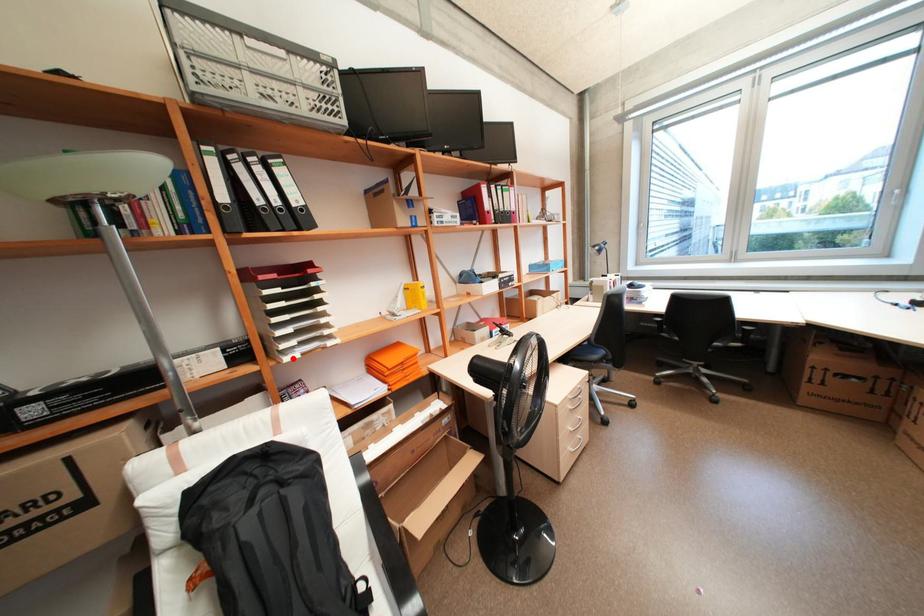
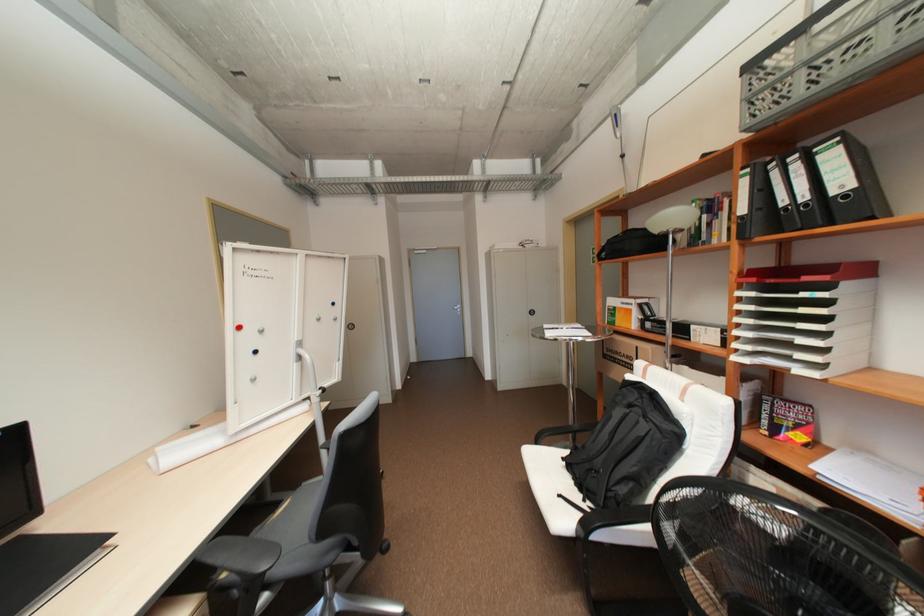
In the second image, find the point that corresponds to the highlighted location in the first image.

(742, 358)